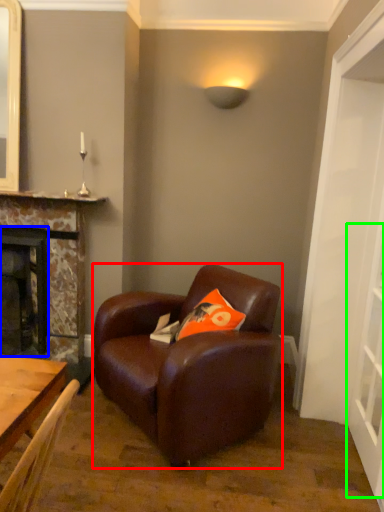
Question: Based on their relative distances, which object is farther from chair (highlighted by a red box)? Choose from fireplace (highlighted by a blue box) and glass door (highlighted by a green box).

Choices:
 (A) fireplace
 (B) glass door

Answer: (A)